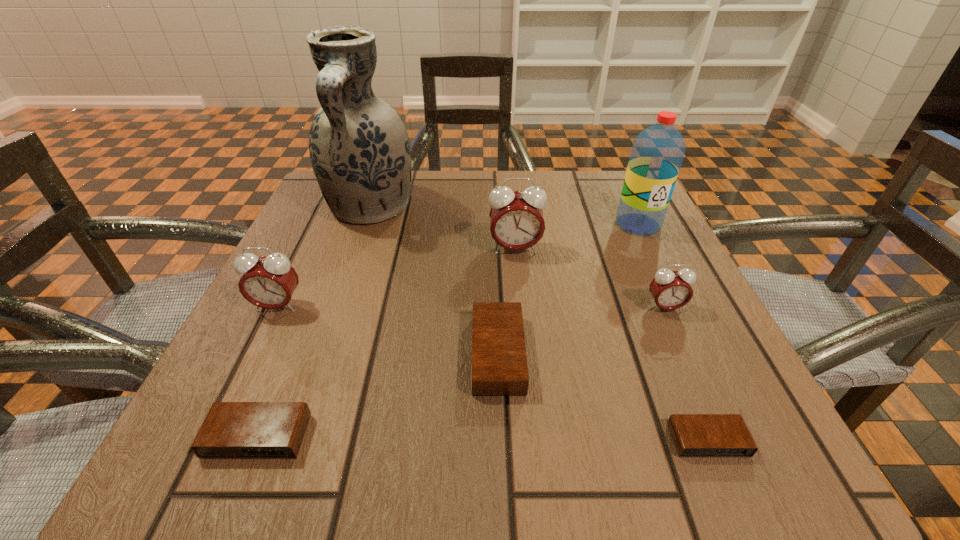
Locate an element on the screen. The image size is (960, 540). the farthest black alarm clock is located at coordinates (499, 362).

I want to click on the biggest black alarm clock, so click(499, 362).

The height and width of the screenshot is (540, 960). Find the location of `the second shortest alarm clock`. the second shortest alarm clock is located at coordinates (231, 430).

This screenshot has width=960, height=540. In order to click on the second biggest black alarm clock in this screenshot , I will do `click(231, 430)`.

At what (x,y) coordinates should I click in order to perform the action: click on the rightmost black alarm clock. Please return your answer as a coordinate pair (x, y). This screenshot has height=540, width=960. Looking at the image, I should click on (694, 435).

At what (x,y) coordinates should I click in order to perform the action: click on the shortest alarm clock. Please return your answer as a coordinate pair (x, y). This screenshot has height=540, width=960. Looking at the image, I should click on (694, 435).

You are a GUI agent. You are given a task and a screenshot of the screen. Output one action in this format:
    pyautogui.click(x=<x>, y=<y>)
    Task: Click on the vacant space located with the handle on the side of the blue vase
    The image size is (960, 540).
    Given the screenshot: What is the action you would take?
    pyautogui.click(x=324, y=341)

Where is `vacant space positioned 0.050m on the front label of the seventh shortest object`? vacant space positioned 0.050m on the front label of the seventh shortest object is located at coordinates (652, 253).

Where is `free spot located on the clock face of the biggest pink alarm clock`? free spot located on the clock face of the biggest pink alarm clock is located at coordinates click(531, 413).

This screenshot has width=960, height=540. Find the location of `free location located 0.120m on the clock face of the second smallest pink alarm clock`. free location located 0.120m on the clock face of the second smallest pink alarm clock is located at coordinates (244, 376).